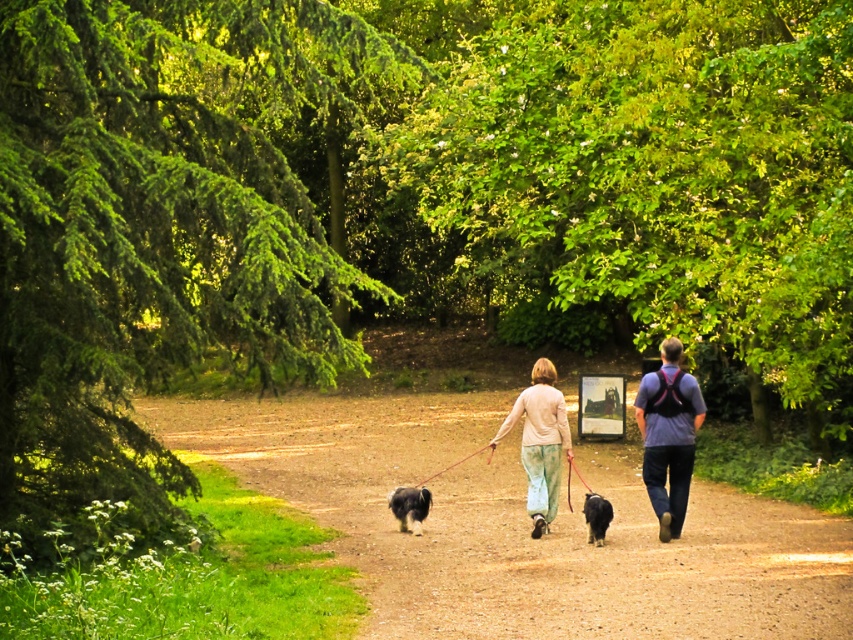
Can you confirm if light beige sweater at center is positioned to the left of soft black fur at center?

Indeed, light beige sweater at center is positioned on the left side of soft black fur at center.

Is point (558, 394) closer to camera compared to point (538, 515)?

No, it is behind (538, 515).

Where is `light beige sweater at center`? light beige sweater at center is located at coordinates (540, 438).

Is matte blue shirt at center in front of fluffy black dog at center?

Yes, it is.

Does point (666, 531) lie behind point (416, 524)?

That is False.

Describe the element at coordinates (668, 435) in the screenshot. I see `matte blue shirt at center` at that location.

Identify the location of matte blue shirt at center. (668, 435).

Can you confirm if matte blue shirt at center is positioned to the right of blue denim jeans at center?

Correct, you'll find matte blue shirt at center to the right of blue denim jeans at center.

Does matte blue shirt at center have a smaller size compared to blue denim jeans at center?

Indeed, matte blue shirt at center has a smaller size compared to blue denim jeans at center.

Which is behind, point (689, 472) or point (653, 433)?

Point (689, 472)

Locate an element on the screen. Image resolution: width=853 pixels, height=640 pixels. matte blue shirt at center is located at coordinates (668, 435).